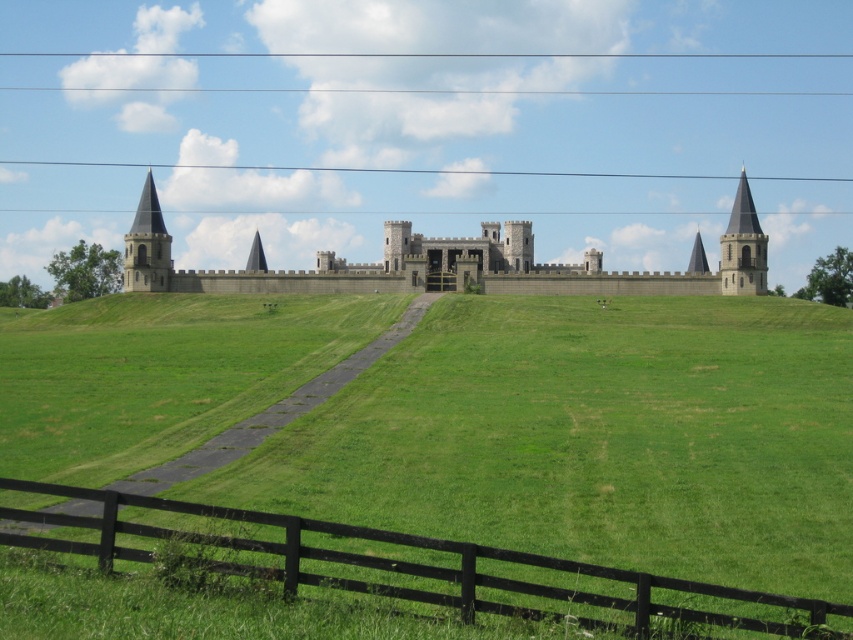
Is gray concrete castle at center wider than smooth stone tower at left?

Correct, the width of gray concrete castle at center exceeds that of smooth stone tower at left.

The width and height of the screenshot is (853, 640). What do you see at coordinates (451, 262) in the screenshot?
I see `gray concrete castle at center` at bounding box center [451, 262].

Does point (514, 241) come closer to viewer compared to point (138, 230)?

No, it is not.

Identify the location of gray concrete castle at center. (451, 262).

Between black wooden fence at lower center and smooth stone tower at left, which one has more height?

smooth stone tower at left is taller.

The image size is (853, 640). In order to click on black wooden fence at lower center in this screenshot , I will do pyautogui.click(x=409, y=568).

Which is below, smooth gray stone tower at right or smooth stone tower at left?

smooth gray stone tower at right

Can you confirm if smooth gray stone tower at right is positioned to the left of smooth stone tower at left?

Incorrect, smooth gray stone tower at right is not on the left side of smooth stone tower at left.

Which is in front, point (718, 272) or point (154, 237)?

Point (718, 272) is in front.

Where is `smooth gray stone tower at right`? Image resolution: width=853 pixels, height=640 pixels. smooth gray stone tower at right is located at coordinates 743,246.